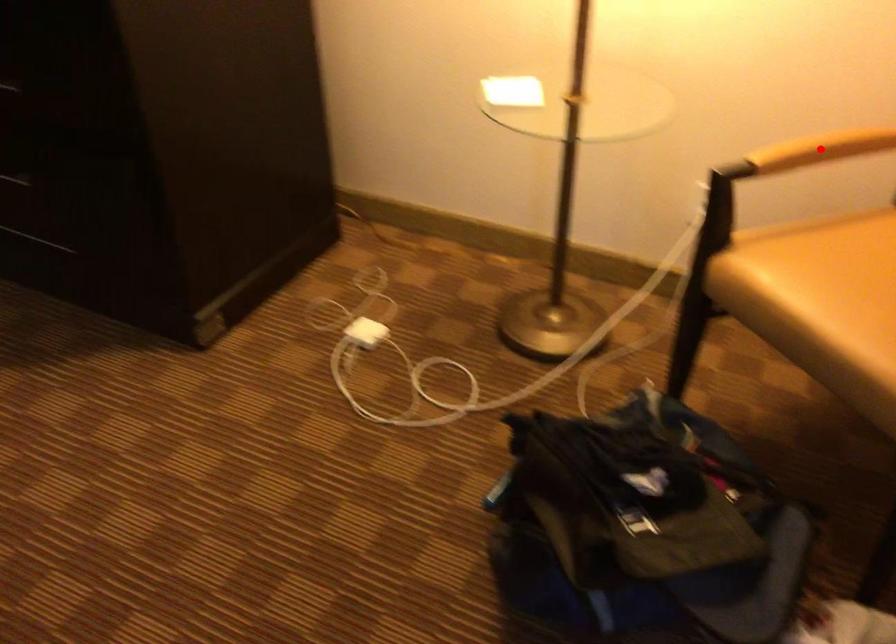
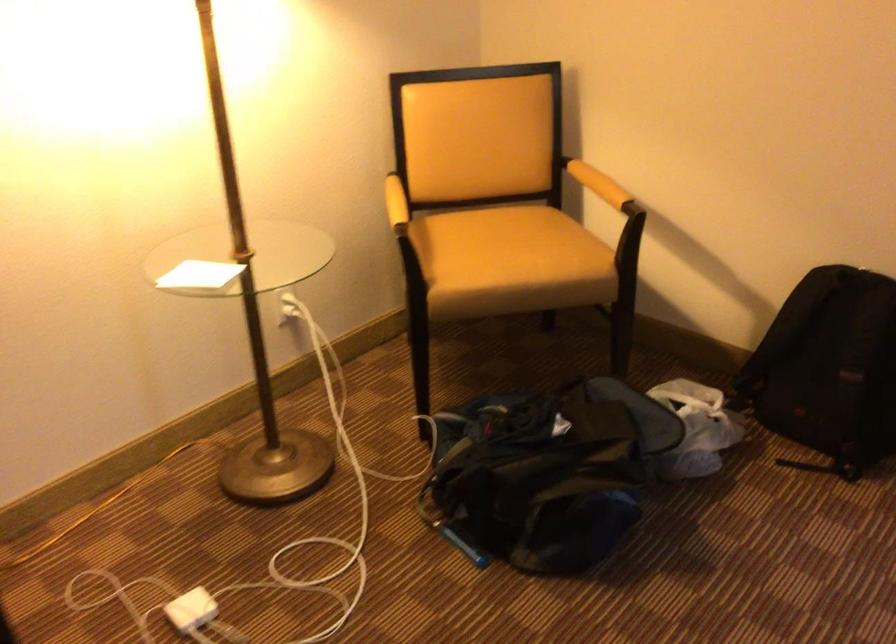
Where in the second image is the point corresponding to the highlighted location from the first image?

(414, 199)